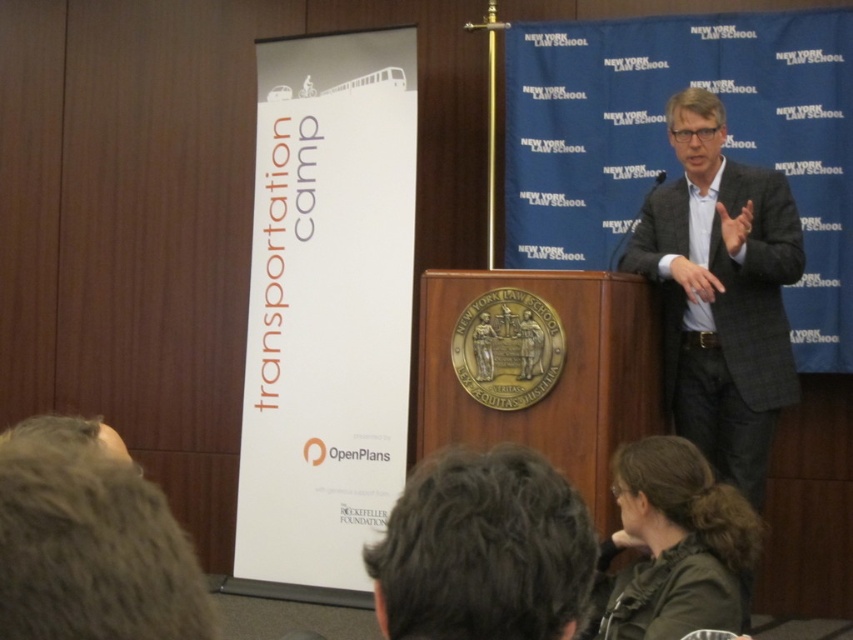
You are attending the event at New York Law School and notice two attendees wearing a gray woolen suit at upper right and a dark green jacket at lower right. Which attendee is closer to the podium where the speaker is standing?

The gray woolen suit at upper right is closer to the podium because the dark green jacket at lower right is behind it, indicating the gray woolen suit is in front and nearer to the speaker.

You are attending the event at the New York Law School and notice two attendees wearing different jackets. The gray woolen suit at upper right and the dark green jacket at lower right. Which one is located to the right side of the other?

The gray woolen suit at upper right is positioned on the right side of dark green jacket at lower right.